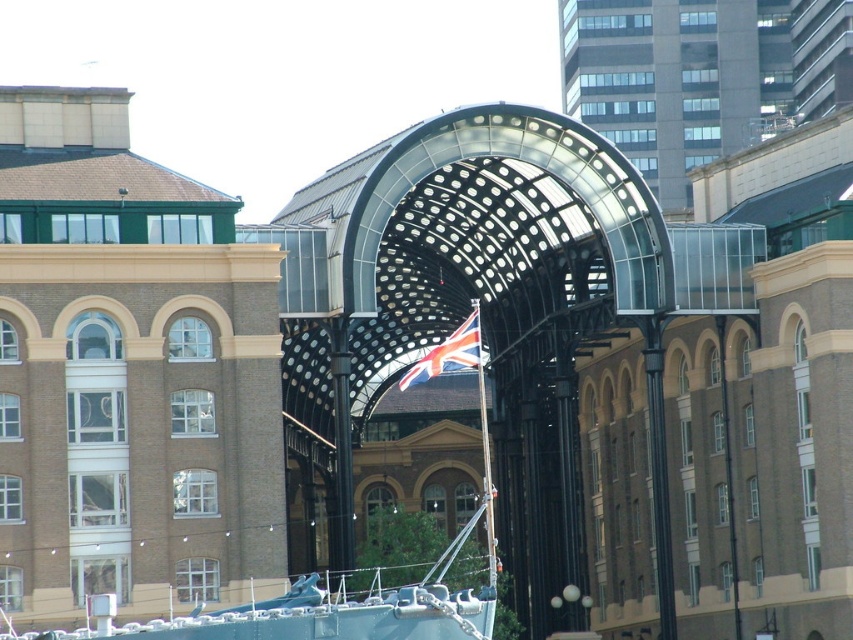
You are a tourist standing at the entrance of the market structure and want to take a photo of both the teal fabric boat at center and the union jack fabric at center. Which object should you position to your left side in the frame to include both in the photo?

The teal fabric boat at center is to the left of the union jack fabric at center, so to include both in the photo, position the teal fabric boat at center to your left side and the union jack fabric at center to your right side.

You are a tour guide leading a group through the market. You want to point out both the teal fabric boat at center and the union jack fabric at center. Since you can only point in one direction, which object is further away from the other?

The teal fabric boat at center and the union jack fabric at center are 25.48 feet apart. Since distance is mutual, both are equally distant from each other, so you can choose either direction to point out both.